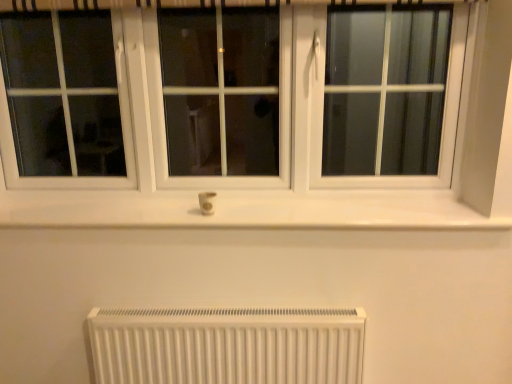
Question: Considering the positions of white plastic electric outlet at center and white matte radiator at lower center in the image, is white plastic electric outlet at center bigger or smaller than white matte radiator at lower center?

Choices:
 (A) small
 (B) big

Answer: (A)

Question: Considering the positions of white plastic electric outlet at center and white matte radiator at lower center in the image, is white plastic electric outlet at center wider or thinner than white matte radiator at lower center?

Choices:
 (A) wide
 (B) thin

Answer: (B)

Question: Considering the positions of point (212, 213) and point (216, 329), is point (212, 213) closer or farther from the camera than point (216, 329)?

Choices:
 (A) closer
 (B) farther

Answer: (B)

Question: From a real-world perspective, is white matte radiator at lower center positioned above or below white plastic electric outlet at center?

Choices:
 (A) above
 (B) below

Answer: (B)

Question: Is point (118, 326) closer or farther from the camera than point (202, 200)?

Choices:
 (A) farther
 (B) closer

Answer: (B)

Question: Visually, is white matte radiator at lower center positioned to the left or to the right of white plastic electric outlet at center?

Choices:
 (A) right
 (B) left

Answer: (A)

Question: From the image's perspective, is white matte radiator at lower center located above or below white plastic electric outlet at center?

Choices:
 (A) above
 (B) below

Answer: (B)